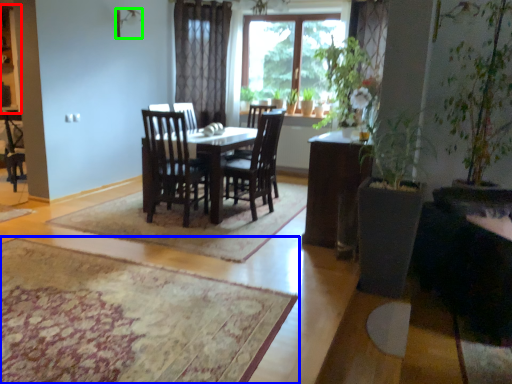
Question: Based on their relative distances, which object is nearer to cabinetry (highlighted by a red box)? Choose from mat (highlighted by a blue box) and lamp (highlighted by a green box).

Choices:
 (A) mat
 (B) lamp

Answer: (B)